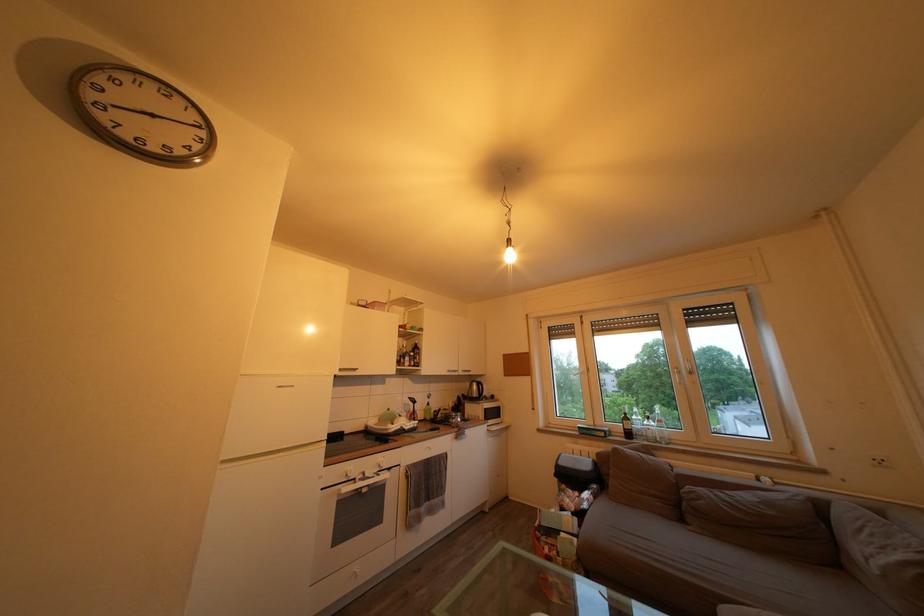
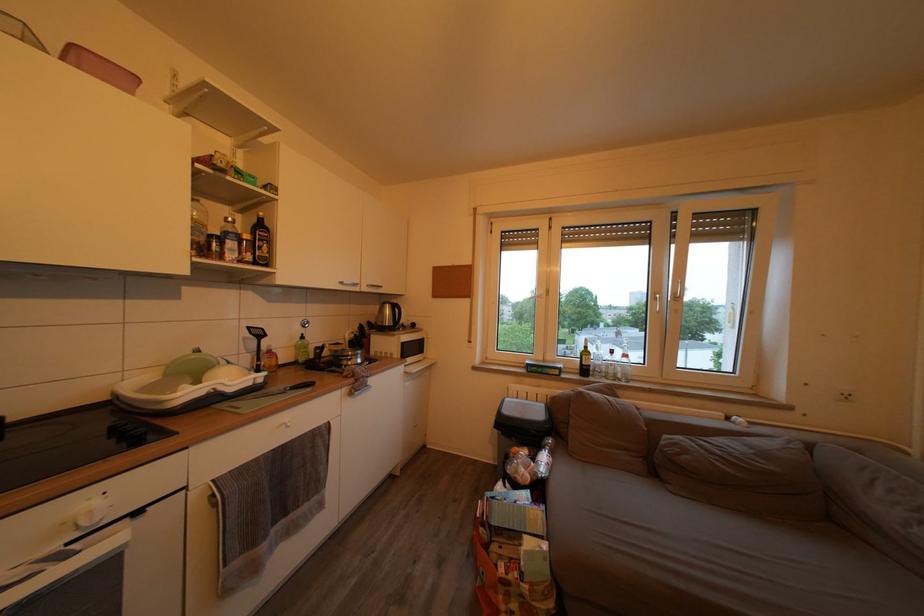
In the second image, find the point that corresponds to (441,416) in the first image.

(320, 353)